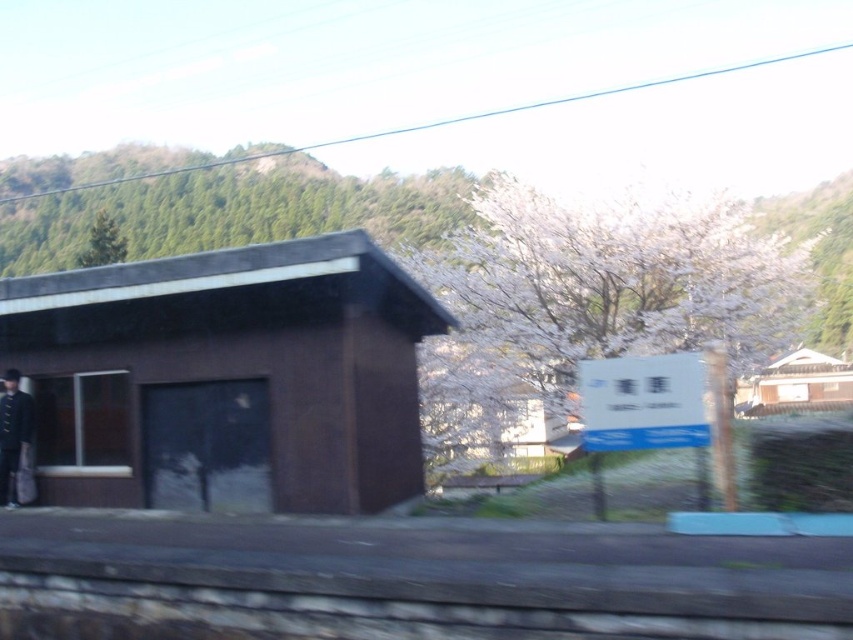
You are a traveler standing in front of the brown matte hut at left and the dark brown leather coat at left. Which object is wider?

The brown matte hut at left is wider than the dark brown leather coat at left.

You are a traveler in this rural area and want to reach the white wooden house at upper right. Which direction should you move relative to the brown matte hut at left?

To reach the white wooden house at upper right, you should move towards the upper right direction from the brown matte hut at left since the brown matte hut at left is in front of it, meaning the house is behind the hut in the scene.